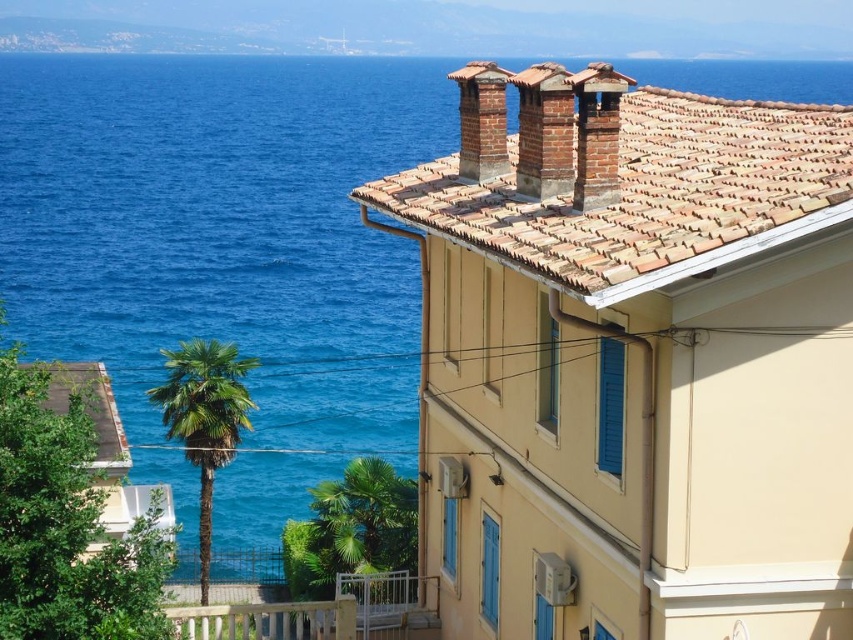
Question: Does white painted wood at lower center have a larger size compared to green leafy palm tree at center-left?

Choices:
 (A) yes
 (B) no

Answer: (B)

Question: Where is white painted wood at lower center located in relation to green leafy palm tree at center-left in the image?

Choices:
 (A) above
 (B) below

Answer: (B)

Question: Which object appears farthest from the camera in this image?

Choices:
 (A) green leafy palm tree at center
 (B) white painted wood at lower center

Answer: (A)

Question: Which of the following is the farthest from the observer?

Choices:
 (A) (189, 627)
 (B) (207, 464)

Answer: (B)

Question: Is white painted wood at lower center in front of green leafy palm tree at center-left?

Choices:
 (A) no
 (B) yes

Answer: (B)

Question: Which object is closer to the camera taking this photo?

Choices:
 (A) green leafy palm tree at center
 (B) white painted wood at lower center

Answer: (B)